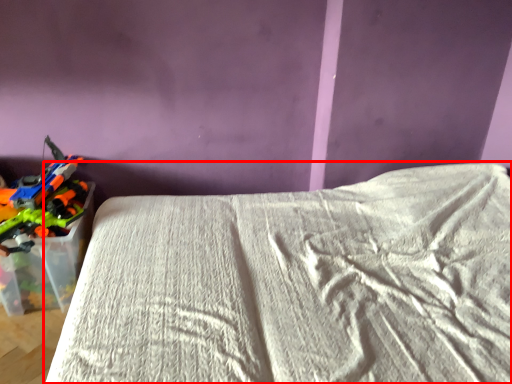
Question: From the image's perspective, where is bed (annotated by the red box) located in relation to toy in the image?

Choices:
 (A) above
 (B) below

Answer: (B)